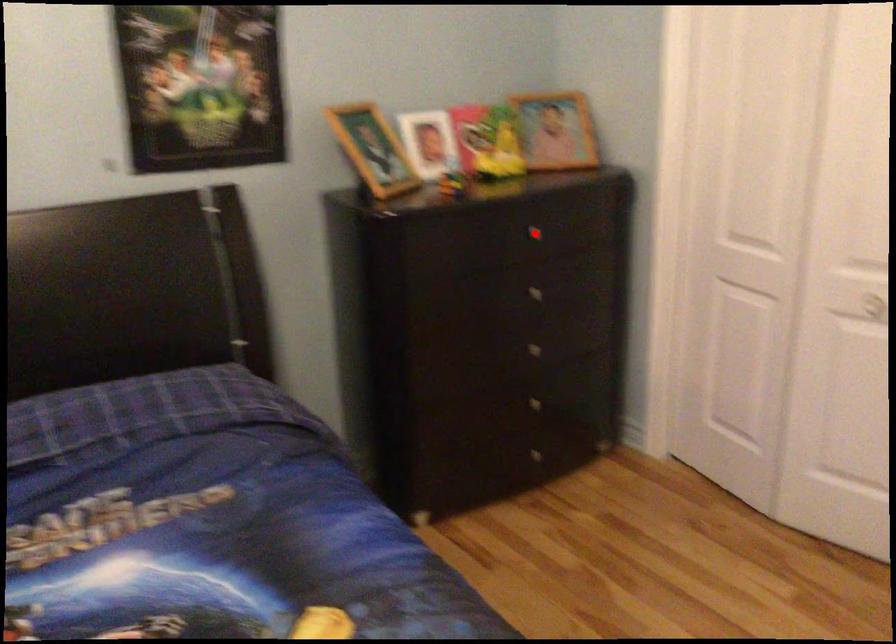
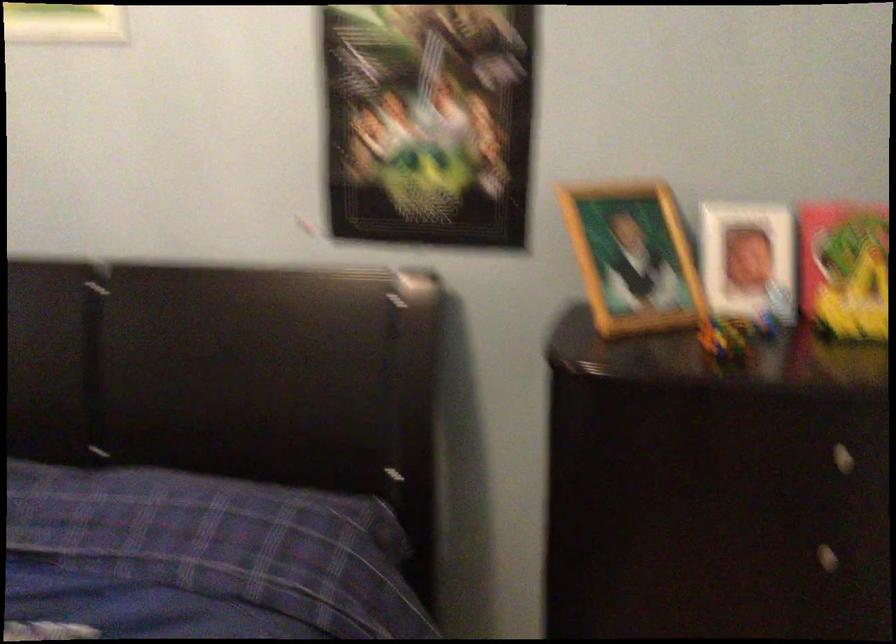
Question: I am providing you with two images of the same scene from different viewpoints. A red point is shown in image1. For the corresponding object point in image2, is it positioned nearer or farther from the camera?

Choices:
 (A) Nearer
 (B) Farther

Answer: (A)